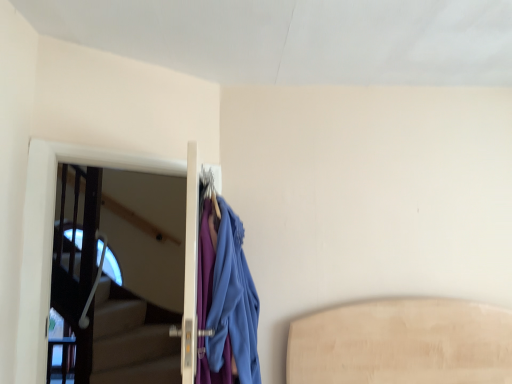
Question: Is blue fabric coat at center to the left or to the right of transparent glass screen door at left in the image?

Choices:
 (A) left
 (B) right

Answer: (B)

Question: From a real-world perspective, is blue fabric coat at center physically located above or below transparent glass screen door at left?

Choices:
 (A) below
 (B) above

Answer: (A)

Question: Is point (257, 354) positioned closer to the camera than point (25, 342)?

Choices:
 (A) farther
 (B) closer

Answer: (A)

Question: Is transparent glass screen door at left spatially inside blue fabric coat at center, or outside of it?

Choices:
 (A) outside
 (B) inside

Answer: (A)

Question: Considering their positions, is transparent glass screen door at left located in front of or behind blue fabric coat at center?

Choices:
 (A) front
 (B) behind

Answer: (B)

Question: In terms of height, does transparent glass screen door at left look taller or shorter compared to blue fabric coat at center?

Choices:
 (A) tall
 (B) short

Answer: (A)

Question: In the image, is transparent glass screen door at left on the left side or the right side of blue fabric coat at center?

Choices:
 (A) right
 (B) left

Answer: (B)